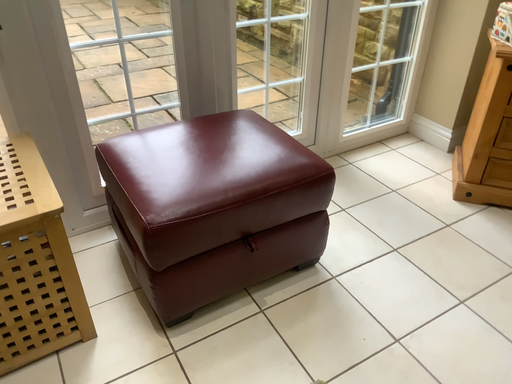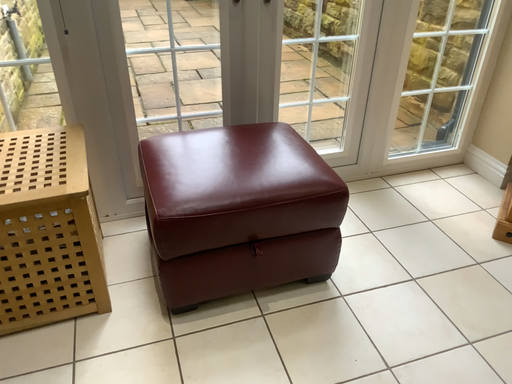
Question: Which way did the camera rotate in the video?

Choices:
 (A) rotated right
 (B) rotated left

Answer: (B)